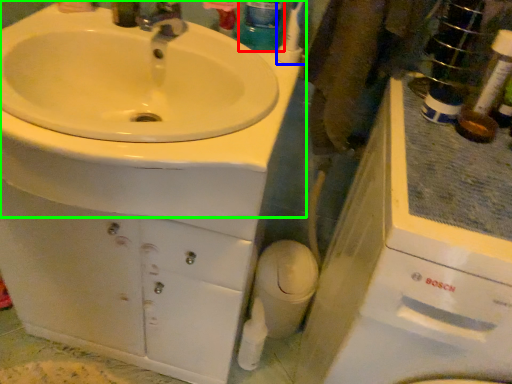
Question: Which object is positioned farthest from mouthwash (highlighted by a red box)? Select from toothbrush (highlighted by a blue box) and sink (highlighted by a green box).

Choices:
 (A) toothbrush
 (B) sink

Answer: (B)